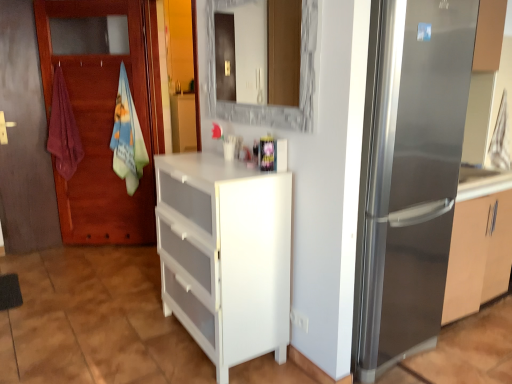
The image size is (512, 384). Identify the location of free region under light blue cotton beach towel at left, the second beach towel in the left-to-right sequence (from a real-world perspective). (136, 245).